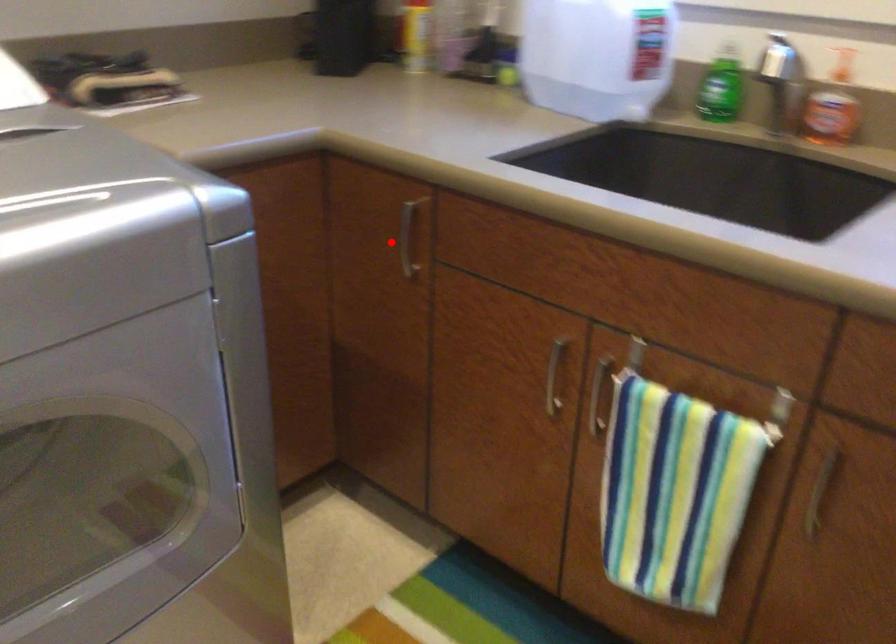
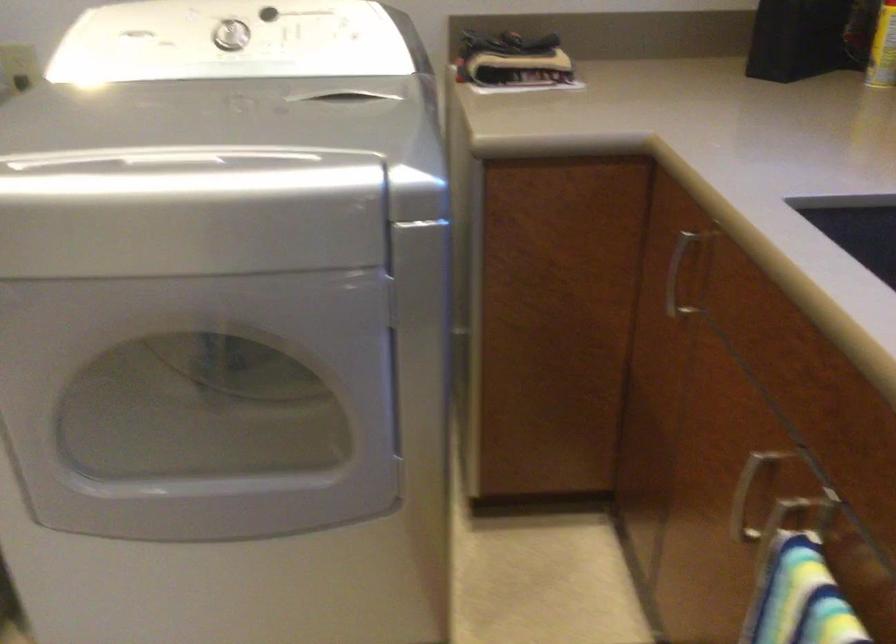
In the second image, find the point that corresponds to the highlighted location in the first image.

(677, 275)